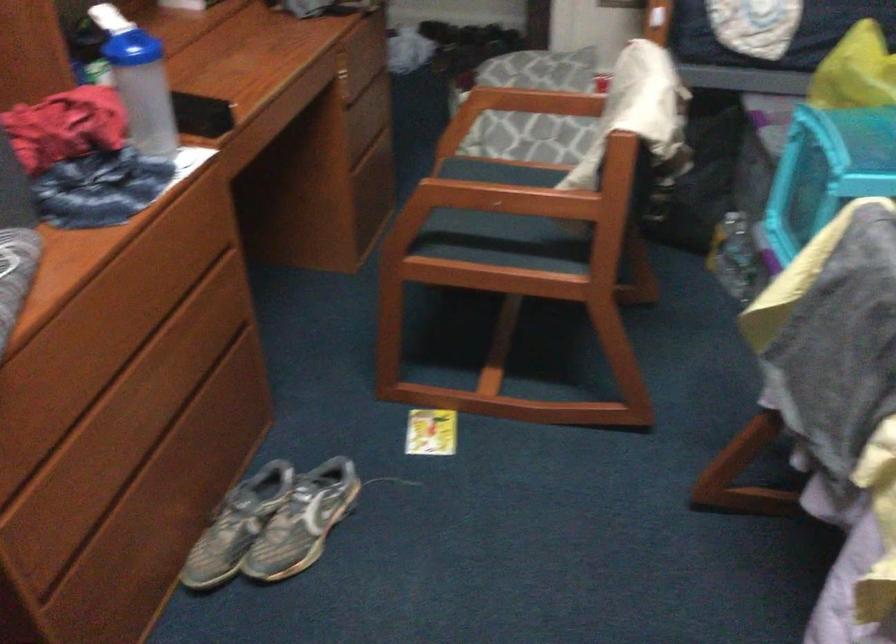
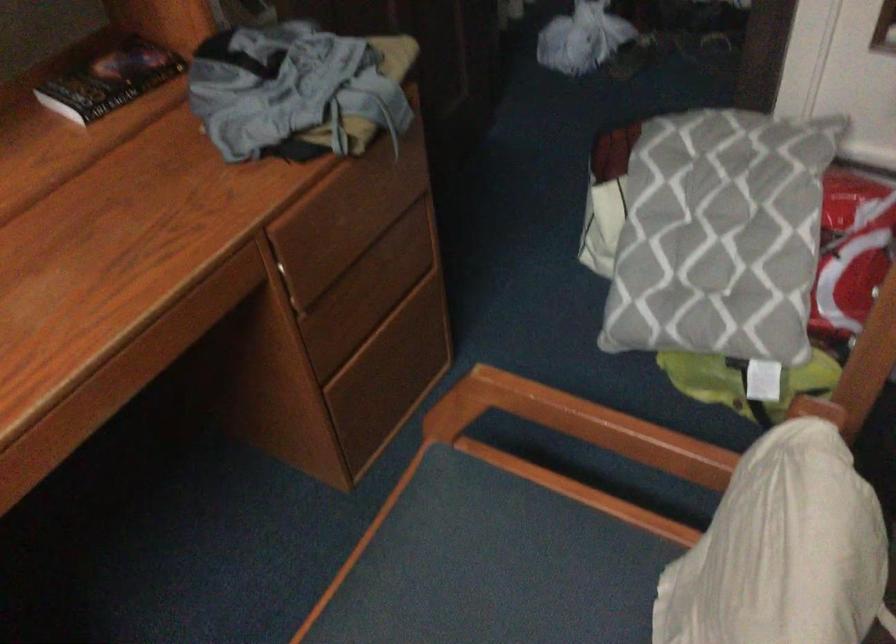
Where in the second image is the point corresponding to (528,182) from the first image?

(549, 580)